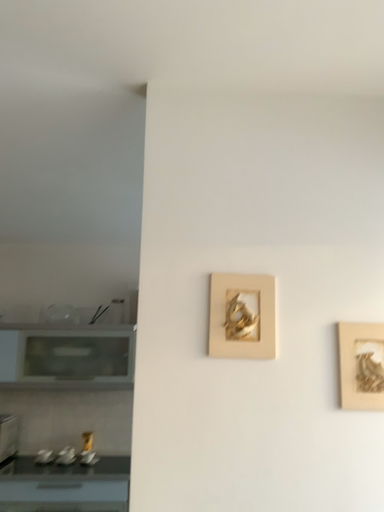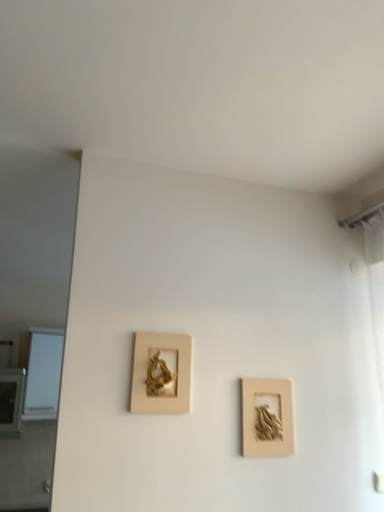
Question: How did the camera likely rotate when shooting the video?

Choices:
 (A) rotated right
 (B) rotated left

Answer: (A)